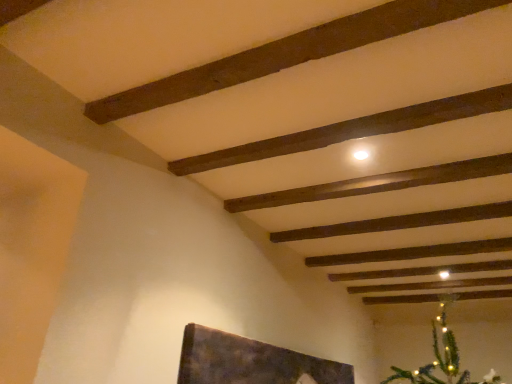
Question: Is smooth wooden plank at center, arranged as the first plank when ordered from the bottom, beside dark brown wood plank at upper center, which is the 2th plank in top-to-bottom order?

Choices:
 (A) yes
 (B) no

Answer: (B)

Question: Is smooth wooden plank at center, marked as the third plank in a top-to-bottom arrangement, further to the viewer compared to dark brown wood plank at upper center, which is the 2th plank in top-to-bottom order?

Choices:
 (A) no
 (B) yes

Answer: (B)

Question: Is smooth wooden plank at center, arranged as the first plank when ordered from the bottom, not within dark brown wood plank at upper center, placed as the second plank when sorted from bottom to top?

Choices:
 (A) yes
 (B) no

Answer: (A)

Question: Considering the relative positions of smooth wooden plank at center, marked as the third plank in a top-to-bottom arrangement, and dark brown wood plank at upper center, placed as the second plank when sorted from bottom to top, in the image provided, is smooth wooden plank at center, marked as the third plank in a top-to-bottom arrangement, to the right of dark brown wood plank at upper center, placed as the second plank when sorted from bottom to top, from the viewer's perspective?

Choices:
 (A) no
 (B) yes

Answer: (B)

Question: Is smooth wooden plank at center, arranged as the first plank when ordered from the bottom, bigger than dark brown wood plank at upper center, which is the 2th plank in top-to-bottom order?

Choices:
 (A) yes
 (B) no

Answer: (B)

Question: Based on their sizes in the image, would you say smooth wooden plank at center, marked as the third plank in a top-to-bottom arrangement, is bigger or smaller than dark brown wood plank at upper center, which is the 2th plank in top-to-bottom order?

Choices:
 (A) big
 (B) small

Answer: (B)

Question: From their relative heights in the image, would you say smooth wooden plank at center, arranged as the first plank when ordered from the bottom, is taller or shorter than dark brown wood plank at upper center, which is the 2th plank in top-to-bottom order?

Choices:
 (A) short
 (B) tall

Answer: (A)

Question: Is point (351, 190) positioned closer to the camera than point (389, 130)?

Choices:
 (A) farther
 (B) closer

Answer: (A)

Question: Is smooth wooden plank at center, arranged as the first plank when ordered from the bottom, wider or thinner than dark brown wood plank at upper center, placed as the second plank when sorted from bottom to top?

Choices:
 (A) thin
 (B) wide

Answer: (A)

Question: From a real-world perspective, is dark brown wood plank at upper center, which is the 2th plank in top-to-bottom order, above or below dark brown wood plank at upper center, placed as the third plank when sorted from bottom to top?

Choices:
 (A) above
 (B) below

Answer: (B)

Question: Is dark brown wood plank at upper center, placed as the second plank when sorted from bottom to top, inside or outside of dark brown wood plank at upper center, placed as the third plank when sorted from bottom to top?

Choices:
 (A) inside
 (B) outside

Answer: (B)

Question: Is dark brown wood plank at upper center, which is the 2th plank in top-to-bottom order, bigger or smaller than dark brown wood plank at upper center, which ranks as the first plank in top-to-bottom order?

Choices:
 (A) big
 (B) small

Answer: (B)

Question: In the image, is dark brown wood plank at upper center, which is the 2th plank in top-to-bottom order, positioned in front of or behind dark brown wood plank at upper center, which ranks as the first plank in top-to-bottom order?

Choices:
 (A) front
 (B) behind

Answer: (B)

Question: In the image, is smooth wooden plank at center, arranged as the first plank when ordered from the bottom, positioned in front of or behind dark brown wood plank at upper center, which ranks as the first plank in top-to-bottom order?

Choices:
 (A) behind
 (B) front

Answer: (A)

Question: From a real-world perspective, is smooth wooden plank at center, arranged as the first plank when ordered from the bottom, physically located above or below dark brown wood plank at upper center, which ranks as the first plank in top-to-bottom order?

Choices:
 (A) below
 (B) above

Answer: (A)